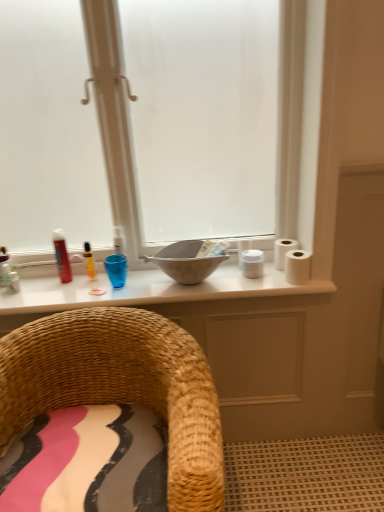
You are a GUI agent. You are given a task and a screenshot of the screen. Output one action in this format:
    pyautogui.click(x=<x>, y=<y>)
    Task: Click on the free location to the left of matte gray bowl at center
    
    Given the screenshot: What is the action you would take?
    pyautogui.click(x=124, y=286)